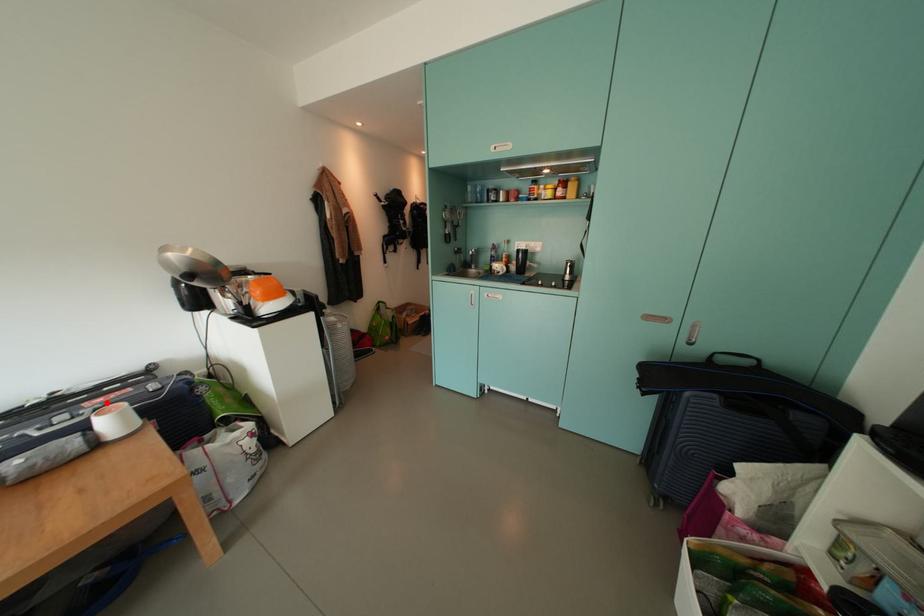
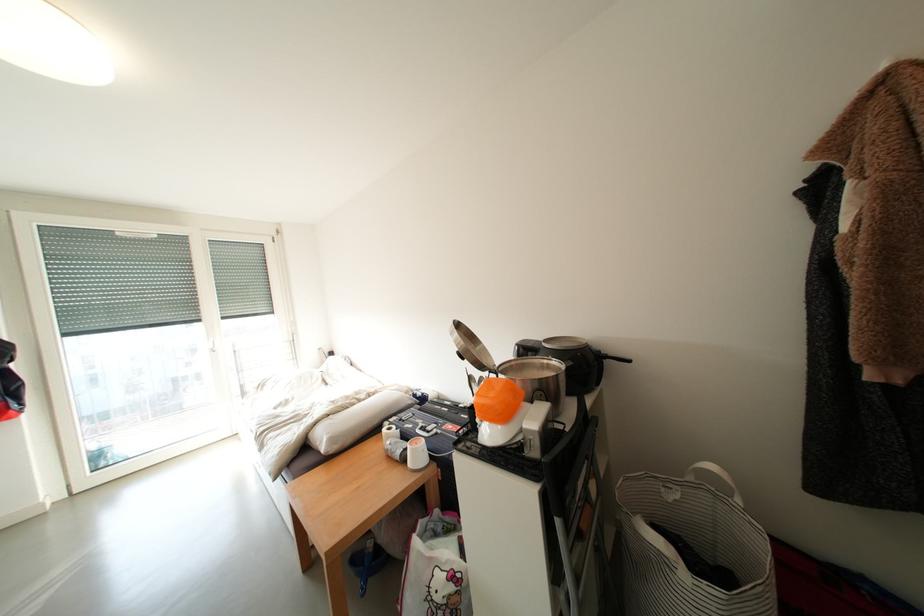
Locate, in the second image, the point that corresponds to the highlighted location in the first image.

(457, 430)